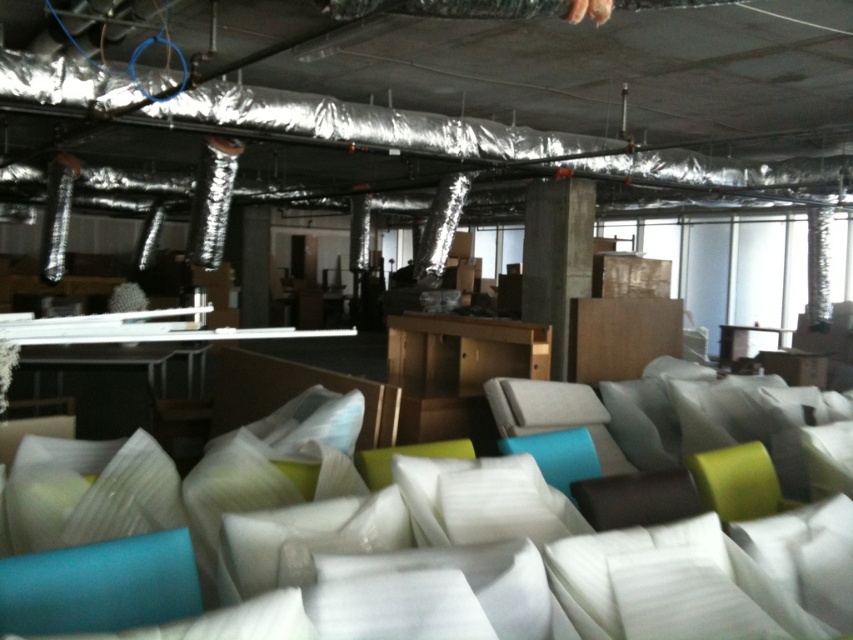
You are standing in the warehouse and see the point marked at coordinates (427,541). What object is located at that point?

The point at (427,541) corresponds to the white fabric couch at center.

You are an interior designer planning to place a new sofa in the storage area. You see the white fabric couch at center and the concrete at center. Which object is located to the left of the other?

The white fabric couch at center is positioned on the left side of concrete at center.

You are an interior designer standing in the storage area and need to move the white fabric couch at center and the wooden cabinet at center. Which object is easier to move first without obstructing the view of the other?

The white fabric couch at center is closer to the viewer than the wooden cabinet at center, so moving the white fabric couch at center first would allow you to see the wooden cabinet at center more clearly afterward.